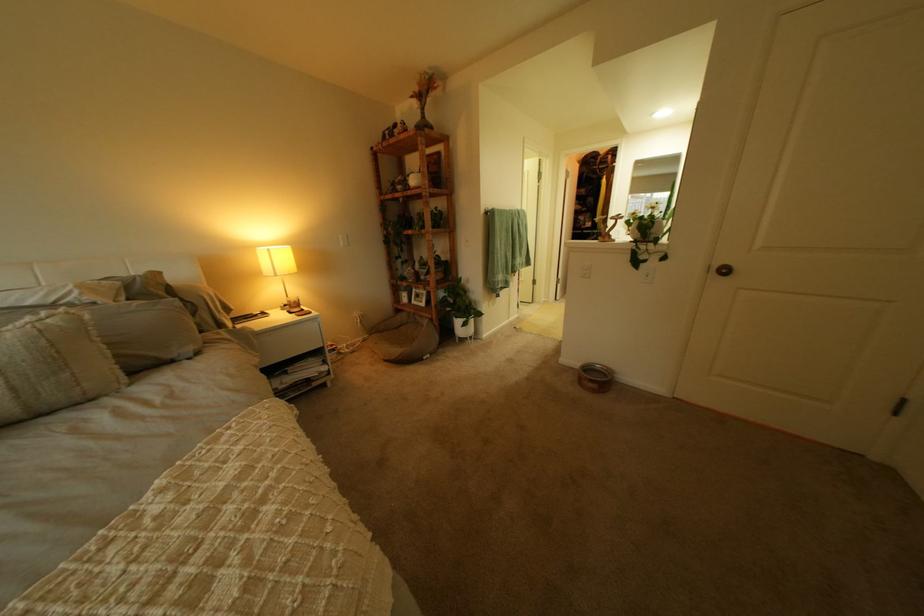
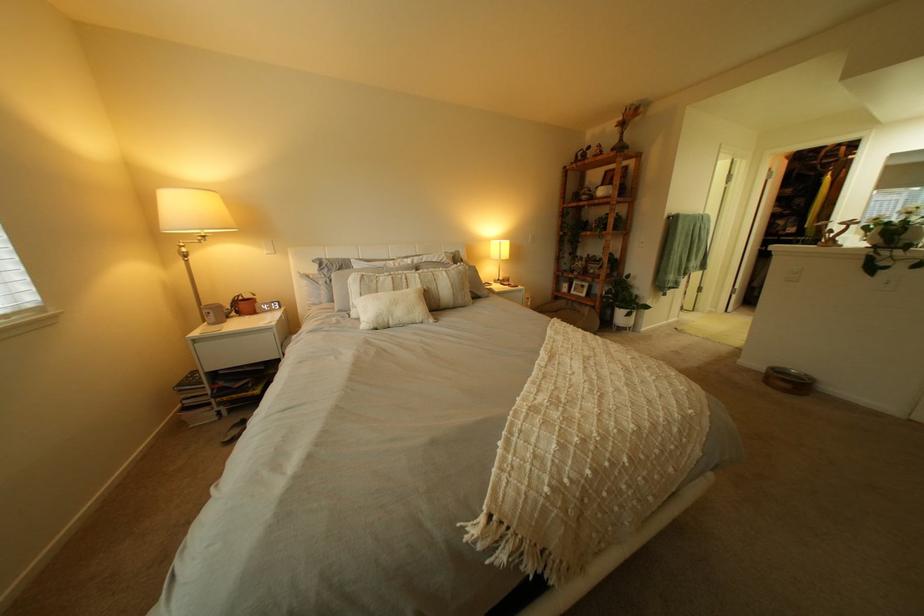
In the second image, find the point that corresponds to pixel 593 367 in the first image.

(779, 369)